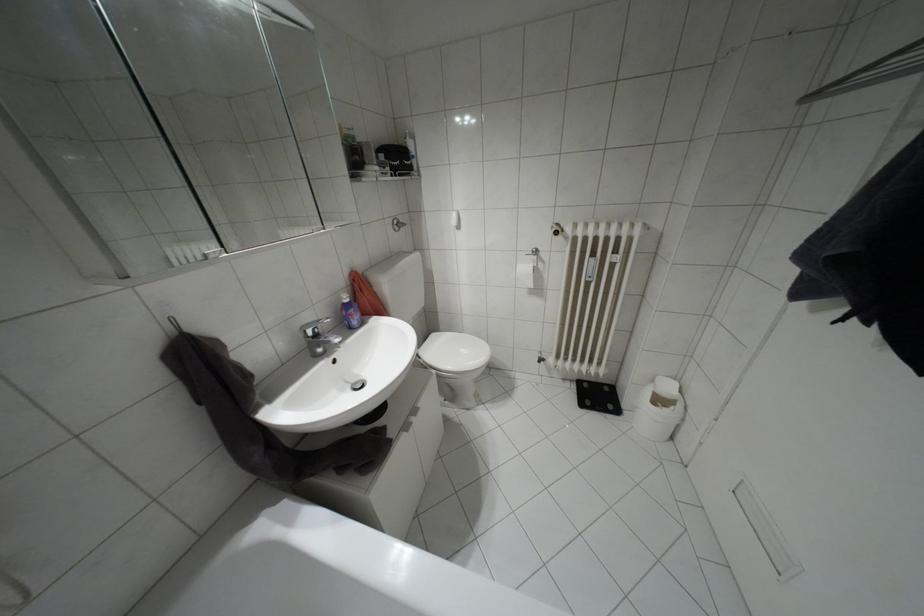
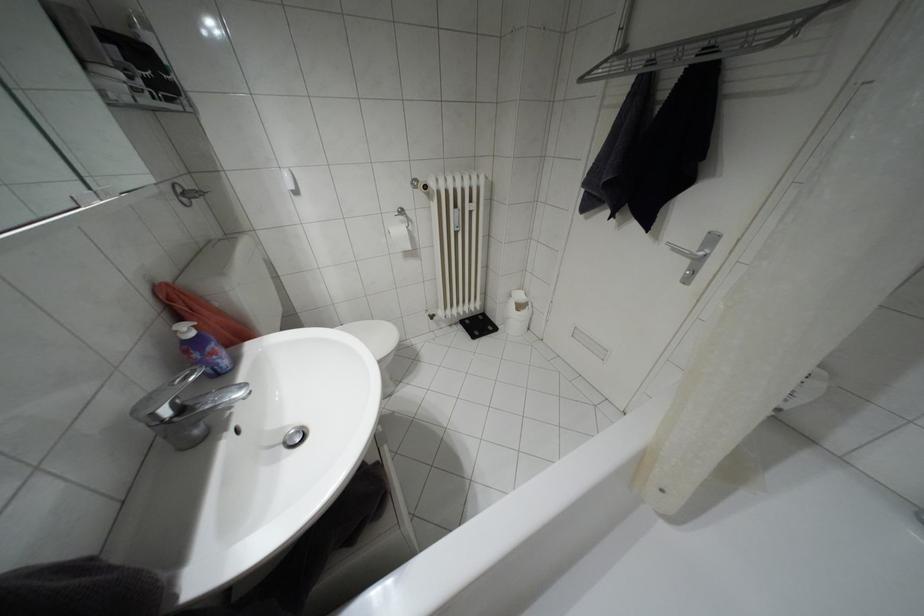
Where in the second image is the point corresponding to the point at 315,334 from the first image?

(180, 408)